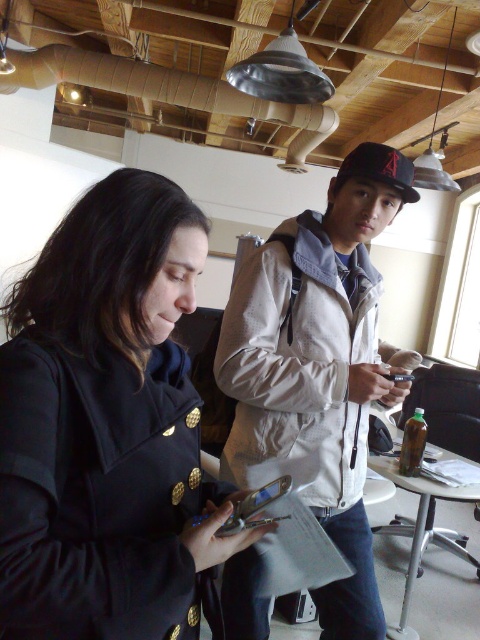
You are an interior designer assessing the space between two central coats. The black matte coat at center and the light beige jacket at center are hanging on adjacent hooks. If you want to place a decorative item between them, which coat allows more space on its side for the item?

The light beige jacket at center has a greater width than the black matte coat at center, so placing the decorative item next to the light beige jacket at center would provide more space.

You are trying to determine which object is bigger between the light beige jacket at center and the silver metallic phone at center. Based on the scene, which one is larger?

The light beige jacket at center has a larger size compared to the silver metallic phone at center, so the light beige jacket at center is bigger.